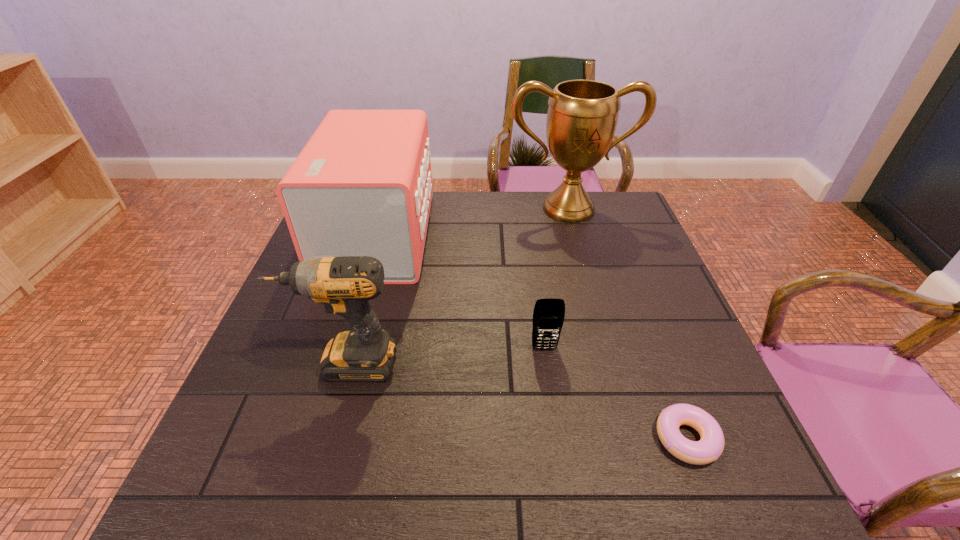
This screenshot has width=960, height=540. I want to click on vacant area that lies between the tallest object and the fourth tallest object, so click(557, 279).

I want to click on vacant space that's between the box and the trophy cup, so click(473, 222).

The width and height of the screenshot is (960, 540). In order to click on free space between the drill and the tallest object in this screenshot , I will do `click(457, 286)`.

Identify the location of free spot between the box and the tallest object. (473, 222).

Locate an element on the screen. Image resolution: width=960 pixels, height=540 pixels. object that is the fourth closest to the tallest object is located at coordinates (709, 448).

Identify which object is located as the fourth nearest to the fourth tallest object. Please provide its 2D coordinates. Your answer should be formatted as a tuple, i.e. [(x, y)], where the tuple contains the x and y coordinates of a point satisfying the conditions above.

[(582, 116)]

This screenshot has height=540, width=960. I want to click on free space that satisfies the following two spatial constraints: 1. on the surface of the trophy cup with symbols; 2. with the drill bit of the drill facing forward, so click(x=612, y=363).

The width and height of the screenshot is (960, 540). Identify the location of vacant point that satisfies the following two spatial constraints: 1. on the surface of the tallest object with symbols; 2. on the right side of the shortest object. (633, 438).

In order to click on free spot that satisfies the following two spatial constraints: 1. on the screen of the nearest object; 2. on the right side of the second shortest object in this screenshot , I will do `click(557, 438)`.

Where is `vacant space that satisfies the following two spatial constraints: 1. on the back side of the shortest object; 2. on the surface of the box where the text is embossed`? The width and height of the screenshot is (960, 540). vacant space that satisfies the following two spatial constraints: 1. on the back side of the shortest object; 2. on the surface of the box where the text is embossed is located at coordinates (610, 235).